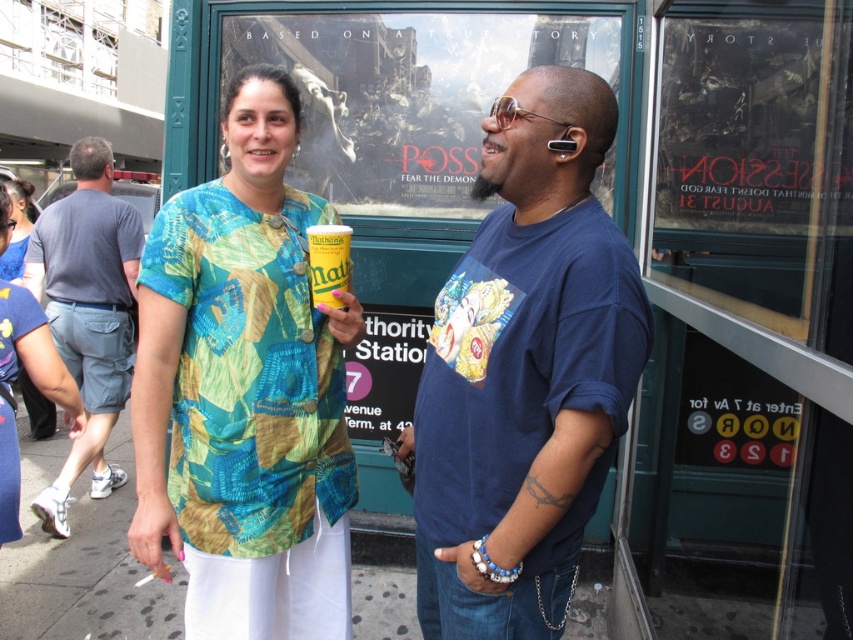
Find the location of a particular element. The height and width of the screenshot is (640, 853). blue cotton t-shirt at center is located at coordinates (525, 371).

What do you see at coordinates (525, 371) in the screenshot? I see `blue cotton t-shirt at center` at bounding box center [525, 371].

Is point (480, 406) more distant than point (70, 269)?

No, it is not.

Find the location of a particular element. Image resolution: width=853 pixels, height=640 pixels. blue cotton t-shirt at center is located at coordinates (525, 371).

Can you confirm if printed fabric shirt at center is positioned to the right of yellow matte can at center?

Incorrect, printed fabric shirt at center is not on the right side of yellow matte can at center.

This screenshot has height=640, width=853. I want to click on printed fabric shirt at center, so click(245, 392).

Between point (184, 404) and point (344, 275), which one is positioned in front?

Point (184, 404) is more forward.

At what (x,y) coordinates should I click in order to perform the action: click on printed fabric shirt at center. Please return your answer as a coordinate pair (x, y). This screenshot has width=853, height=640. Looking at the image, I should click on (245, 392).

Between point (579, 195) and point (312, 264), which one is positioned behind?

The point (312, 264) is behind.

Who is shorter, blue cotton t-shirt at center or yellow matte can at center?

With less height is yellow matte can at center.

Does point (554, 529) come closer to viewer compared to point (332, 256)?

Yes, point (554, 529) is in front of point (332, 256).

The height and width of the screenshot is (640, 853). Find the location of `blue cotton t-shirt at center`. blue cotton t-shirt at center is located at coordinates (525, 371).